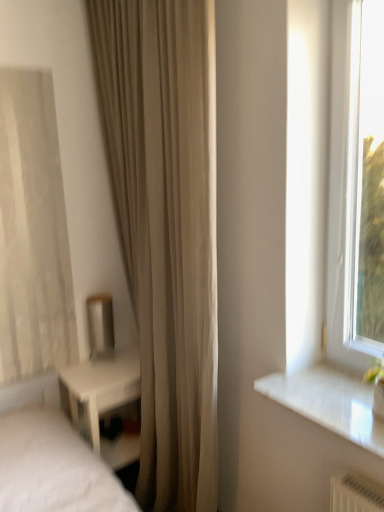
Measure the distance between point (134, 67) and camera.

They are 1.66 meters apart.

The height and width of the screenshot is (512, 384). Identify the location of beige fabric curtain at center. (166, 228).

The image size is (384, 512). What do you see at coordinates (166, 228) in the screenshot?
I see `beige fabric curtain at center` at bounding box center [166, 228].

Locate an element on the screen. The width and height of the screenshot is (384, 512). white glossy nightstand at lower left is located at coordinates (106, 399).

What do you see at coordinates (106, 399) in the screenshot? I see `white glossy nightstand at lower left` at bounding box center [106, 399].

The image size is (384, 512). In order to click on beige fabric curtain at center in this screenshot , I will do `click(166, 228)`.

Would you say beige fabric curtain at center is to the left or to the right of white glossy nightstand at lower left in the picture?

beige fabric curtain at center is to the right of white glossy nightstand at lower left.

Which object is closer to the camera taking this photo, beige fabric curtain at center or white glossy nightstand at lower left?

beige fabric curtain at center is closer to the camera.

Which point is more distant from viewer, (214, 307) or (118, 452)?

The point (118, 452) is behind.

From the image's perspective, is beige fabric curtain at center located above or below white glossy nightstand at lower left?

Clearly, from the image's perspective, beige fabric curtain at center is above white glossy nightstand at lower left.

From a real-world perspective, is beige fabric curtain at center above or below white glossy nightstand at lower left?

In terms of real-world spatial position, beige fabric curtain at center is above white glossy nightstand at lower left.

Which object is thinner, beige fabric curtain at center or white glossy nightstand at lower left?

beige fabric curtain at center.

Based on the photo, can you confirm if beige fabric curtain at center is taller than white glossy nightstand at lower left?

Yes, beige fabric curtain at center is taller than white glossy nightstand at lower left.

Can you confirm if beige fabric curtain at center is smaller than white glossy nightstand at lower left?

Incorrect, beige fabric curtain at center is not smaller in size than white glossy nightstand at lower left.

Is white glossy nightstand at lower left a part of beige fabric curtain at center?

Yes, white glossy nightstand at lower left is a part of beige fabric curtain at center.

Is beige fabric curtain at center with white glossy nightstand at lower left?

They are not placed beside each other.

Is beige fabric curtain at center facing away from white glossy nightstand at lower left?

Yes, beige fabric curtain at center is facing away from white glossy nightstand at lower left.

In the scene shown: How many degrees apart are the facing directions of beige fabric curtain at center and white glossy nightstand at lower left?

beige fabric curtain at center and white glossy nightstand at lower left are facing 90.3 degrees away from each other.

I want to click on curtain lying in front of the white glossy nightstand at lower left, so click(x=166, y=228).

Is white glossy nightstand at lower left to the left of beige fabric curtain at center from the viewer's perspective?

Yes, white glossy nightstand at lower left is to the left of beige fabric curtain at center.

In the image, is white glossy nightstand at lower left positioned in front of or behind beige fabric curtain at center?

Visually, white glossy nightstand at lower left is located behind beige fabric curtain at center.

Is point (112, 465) closer to camera compared to point (151, 290)?

No, (112, 465) is further to viewer.

Consider the image. From the image's perspective, who appears lower, white glossy nightstand at lower left or beige fabric curtain at center?

white glossy nightstand at lower left is shown below in the image.

From a real-world perspective, which is physically below, white glossy nightstand at lower left or beige fabric curtain at center?

white glossy nightstand at lower left is physically lower.

Which of these two, white glossy nightstand at lower left or beige fabric curtain at center, is thinner?

beige fabric curtain at center.

Can you confirm if white glossy nightstand at lower left is shorter than beige fabric curtain at center?

Yes.

Does white glossy nightstand at lower left have a smaller size compared to beige fabric curtain at center?

Yes, white glossy nightstand at lower left is smaller than beige fabric curtain at center.

Is white glossy nightstand at lower left situated inside beige fabric curtain at center or outside?

white glossy nightstand at lower left exists entirely within beige fabric curtain at center.

Based on the photo, is white glossy nightstand at lower left directly adjacent to beige fabric curtain at center?

No.

Could you tell me if white glossy nightstand at lower left is facing beige fabric curtain at center?

Yes, white glossy nightstand at lower left is aimed at beige fabric curtain at center.

Find the location of a particular element. curtain located above the white glossy nightstand at lower left (from a real-world perspective) is located at coordinates (166, 228).

Where is `curtain that is on the right side of white glossy nightstand at lower left`? Image resolution: width=384 pixels, height=512 pixels. curtain that is on the right side of white glossy nightstand at lower left is located at coordinates (166, 228).

Image resolution: width=384 pixels, height=512 pixels. I want to click on nightstand behind the beige fabric curtain at center, so click(x=106, y=399).